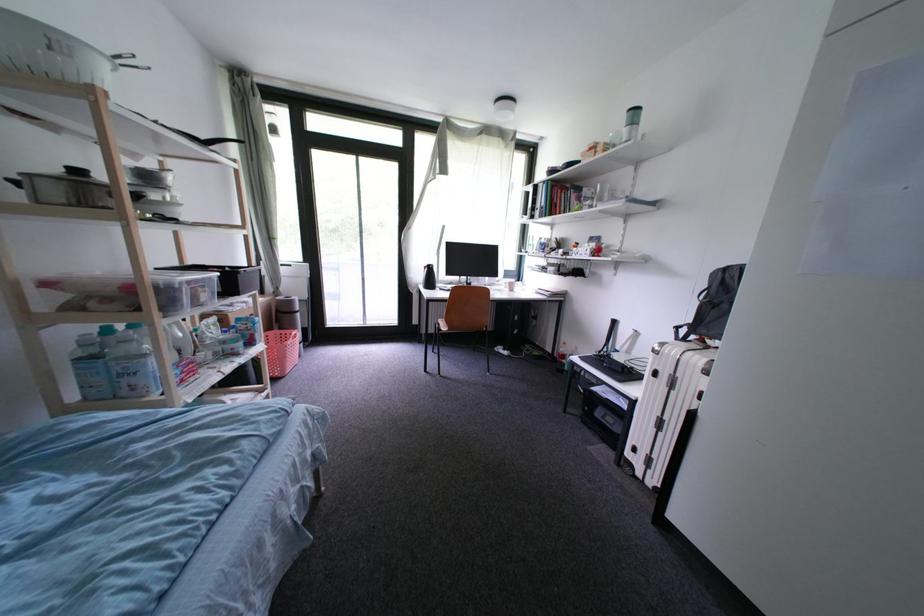
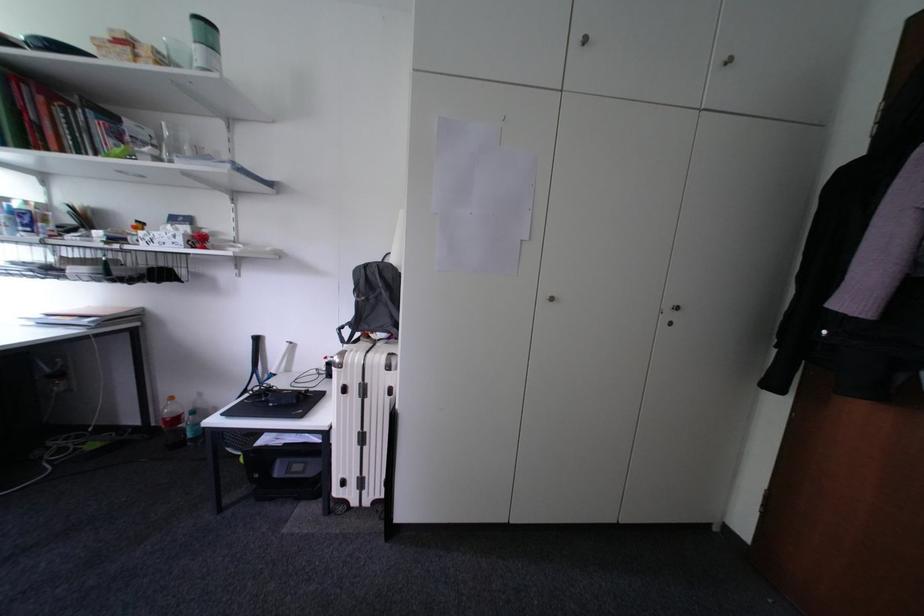
The point at [663,377] is marked in the first image. Where is the corresponding point in the second image?

(353, 392)